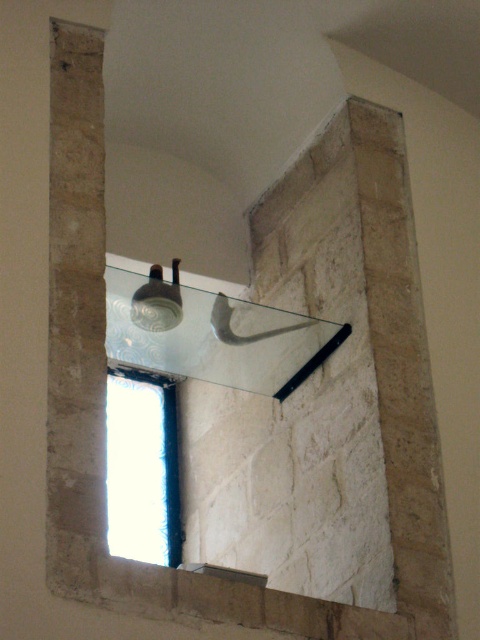
You are an interior designer assessing the layout of a modern living room. You notice a clear glass mirror at upper center and a transparent glass window at center. Based on their positions, which object is positioned to the right side of the other?

The clear glass mirror at upper center is to the right of the transparent glass window at center.

You are an interior designer planning to place a new lamp on the glass shelf in the image. You have two points marked on the shelf, point (277,353) and point (152,282). If you want to place the lamp closer to the viewer, which point should you choose?

Point (152,282) is closer to the viewer than point (277,353), so placing the lamp there would position it closer to the viewer.